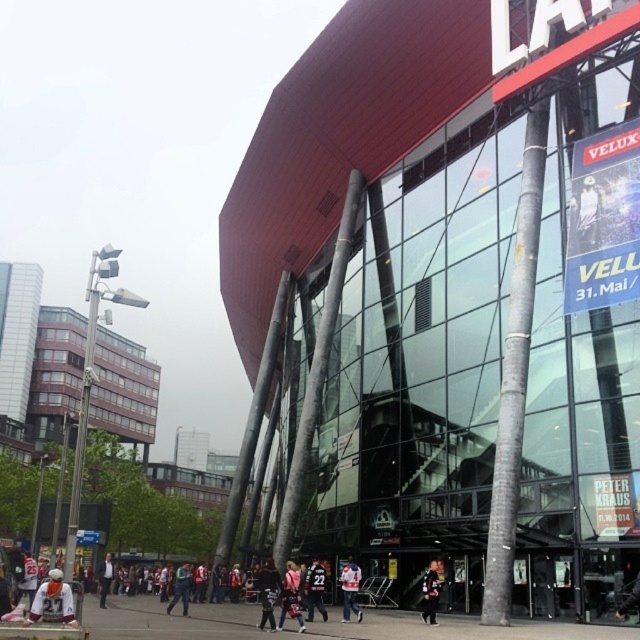
You are standing at the entrance of the modern architectural structure described in the scene. Looking out, you notice a point marked at coordinates (349, 589). What object or feature is located at this point?

The point at coordinates (349, 589) indicates a white jersey at center.

You are a photographer trying to capture both the red fabric jacket at center and the black leather jacket at lower center in a single shot. Which jacket will appear bigger in the photo?

The red fabric jacket at center will appear bigger in the photo because it is larger in size than the black leather jacket at lower center.